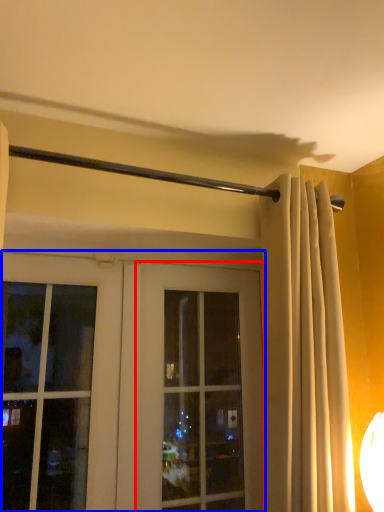
Question: Which point is closer to the camera, window (highlighted by a red box) or door (highlighted by a blue box)?

Choices:
 (A) window
 (B) door

Answer: (B)